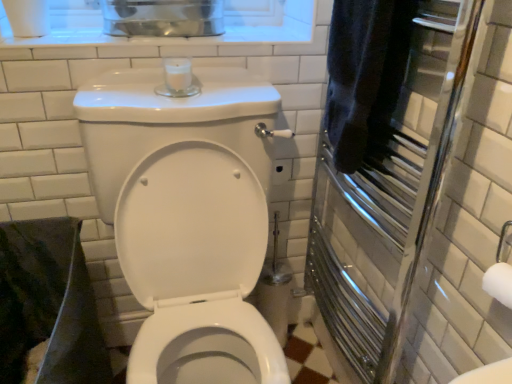
Question: From the image's perspective, is white glossy toilet at center located beneath polished chrome towel warmer at right?

Choices:
 (A) yes
 (B) no

Answer: (A)

Question: Is white glossy toilet at center to the left of polished chrome towel warmer at right from the viewer's perspective?

Choices:
 (A) no
 (B) yes

Answer: (B)

Question: Could you tell me if white glossy toilet at center is facing polished chrome towel warmer at right?

Choices:
 (A) yes
 (B) no

Answer: (B)

Question: Does white glossy toilet at center come behind polished chrome towel warmer at right?

Choices:
 (A) yes
 (B) no

Answer: (B)

Question: Is the surface of white glossy toilet at center in direct contact with polished chrome towel warmer at right?

Choices:
 (A) yes
 (B) no

Answer: (B)

Question: From a real-world perspective, is white glossy toilet at center positioned over polished chrome towel warmer at right based on gravity?

Choices:
 (A) yes
 (B) no

Answer: (B)

Question: Considering the relative sizes of dark blue towel at right and white glossy toilet at center in the image provided, is dark blue towel at right thinner than white glossy toilet at center?

Choices:
 (A) yes
 (B) no

Answer: (A)

Question: Is the depth of dark blue towel at right less than that of white glossy toilet at center?

Choices:
 (A) yes
 (B) no

Answer: (B)

Question: Does dark blue towel at right have a greater height compared to white glossy toilet at center?

Choices:
 (A) no
 (B) yes

Answer: (A)

Question: Is white glossy toilet at center located within dark blue towel at right?

Choices:
 (A) yes
 (B) no

Answer: (B)

Question: Is dark blue towel at right looking in the opposite direction of white glossy toilet at center?

Choices:
 (A) yes
 (B) no

Answer: (B)

Question: Are dark blue towel at right and white glossy toilet at center beside each other?

Choices:
 (A) yes
 (B) no

Answer: (B)

Question: From a real-world perspective, does polished chrome towel warmer at right stand above dark blue towel at right?

Choices:
 (A) yes
 (B) no

Answer: (B)